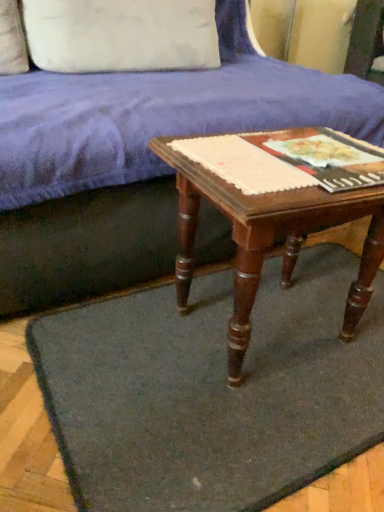
Find the location of a particular element. This screenshot has height=512, width=384. free space to the left of matte paper at center, the 2th paperback book positioned from the left is located at coordinates (223, 156).